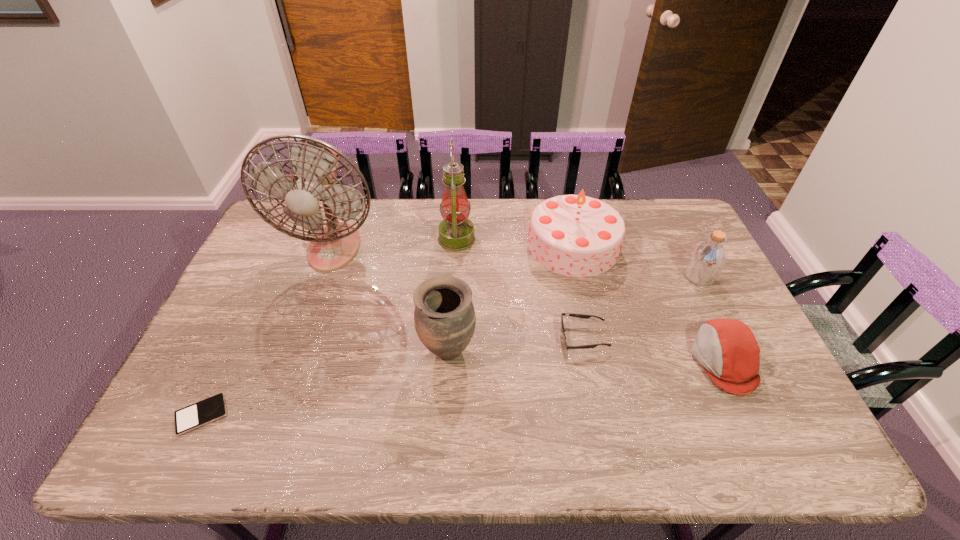
I want to click on free space located on the front of the birthday cake, so click(x=604, y=381).

You are a GUI agent. You are given a task and a screenshot of the screen. Output one action in this format:
    pyautogui.click(x=<x>, y=<y>)
    Task: Click on the free space located 0.150m on the back of the urn
    
    Given the screenshot: What is the action you would take?
    pyautogui.click(x=451, y=288)

At what (x,y) coordinates should I click in order to perform the action: click on vacant space located on the left of the bottle. Please return your answer as a coordinate pair (x, y). The image size is (960, 540). Looking at the image, I should click on (579, 277).

Where is `free location located 0.240m on the front-facing side of the cap`? free location located 0.240m on the front-facing side of the cap is located at coordinates pos(602,362).

Find the location of a particular element. This screenshot has width=960, height=540. free point located on the front-facing side of the cap is located at coordinates (617, 362).

Locate an element on the screen. This screenshot has width=960, height=540. vacant space positioned on the front-facing side of the cap is located at coordinates pos(541,362).

In order to click on vacant region located 0.400m on the front-facing side of the seventh tallest object in this screenshot , I will do `click(416, 338)`.

The height and width of the screenshot is (540, 960). Find the location of `vacant space located 0.200m on the front-facing side of the seventh tallest object`. vacant space located 0.200m on the front-facing side of the seventh tallest object is located at coordinates (488, 338).

Locate an element on the screen. The width and height of the screenshot is (960, 540). vacant space situated 0.100m on the front-facing side of the seventh tallest object is located at coordinates (524, 338).

I want to click on blank space located 0.200m on the right of the shortest object, so 311,415.